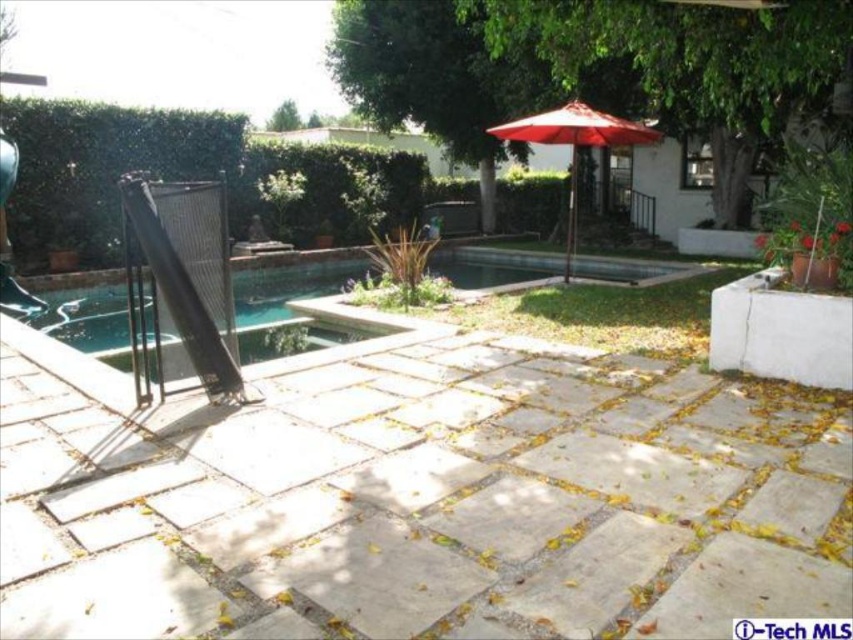
Is green leafy hedge at upper left above blue tile swimming pool at center?

Indeed, green leafy hedge at upper left is positioned over blue tile swimming pool at center.

Between green leafy hedge at upper left and blue tile swimming pool at center, which one appears on the right side from the viewer's perspective?

From the viewer's perspective, blue tile swimming pool at center appears more on the right side.

Does point (28, 109) come behind point (120, 330)?

Yes, it is behind point (120, 330).

Identify the location of green leafy hedge at upper left. This screenshot has height=640, width=853. (102, 168).

How far apart are green leafy hedge at upper left and green leafy hedge at center?

green leafy hedge at upper left is 21.13 feet away from green leafy hedge at center.

Does green leafy hedge at upper left come behind green leafy hedge at center?

No, green leafy hedge at upper left is closer to the viewer.

Is point (192, 141) more distant than point (360, 225)?

No, (192, 141) is closer to viewer.

Image resolution: width=853 pixels, height=640 pixels. I want to click on green leafy hedge at upper left, so click(x=102, y=168).

Which of these two, blue tile swimming pool at center or green leafy hedge at center, stands taller?

With more height is blue tile swimming pool at center.

Can you confirm if blue tile swimming pool at center is positioned above green leafy hedge at center?

Incorrect, blue tile swimming pool at center is not positioned above green leafy hedge at center.

The width and height of the screenshot is (853, 640). What do you see at coordinates (288, 282) in the screenshot? I see `blue tile swimming pool at center` at bounding box center [288, 282].

The image size is (853, 640). I want to click on blue tile swimming pool at center, so click(288, 282).